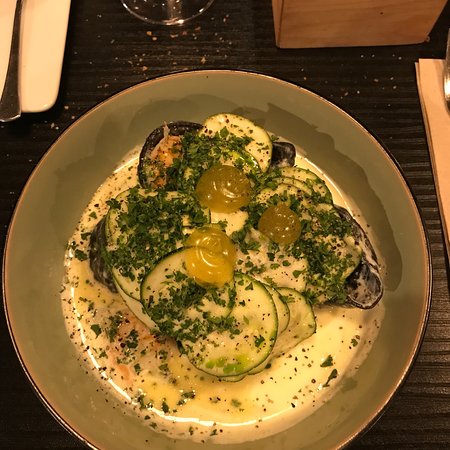
Find the location of `wooden table background`. wooden table background is located at coordinates (397, 420).